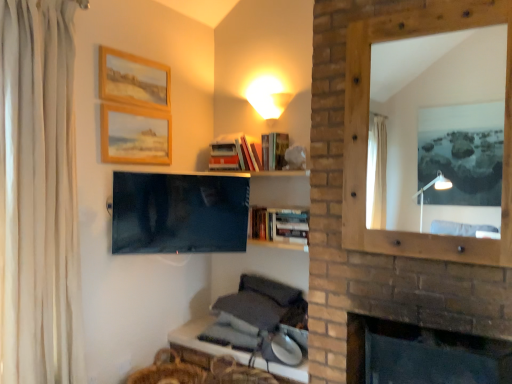
Find the location of `vacant region under wooden mirror at right (from a real-world perspective)`. vacant region under wooden mirror at right (from a real-world perspective) is located at coordinates (x=449, y=339).